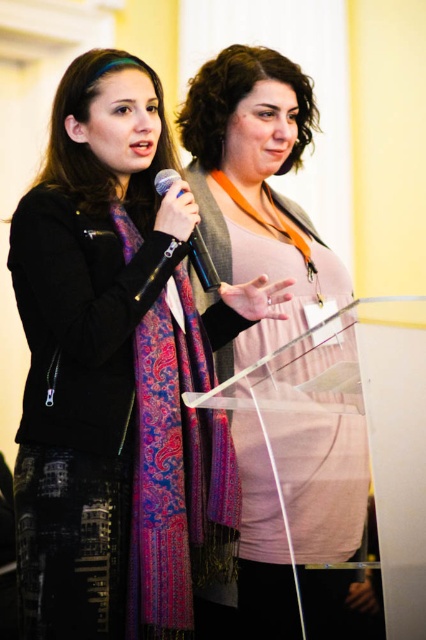
Question: Which object is closer to the camera taking this photo?

Choices:
 (A) matte black jacket at left
 (B) paisley-patterned silk scarf at center
 (C) metallic blue microphone at center

Answer: (A)

Question: Which of the following is the closest to the observer?

Choices:
 (A) pink fabric at center
 (B) paisley-patterned silk scarf at center
 (C) metallic blue microphone at center
 (D) matte black jacket at left

Answer: (D)

Question: Does matte black jacket at left appear under paisley-patterned silk scarf at center?

Choices:
 (A) no
 (B) yes

Answer: (A)

Question: Which point is farther to the camera?

Choices:
 (A) (193, 268)
 (B) (46, 456)

Answer: (A)

Question: Can you confirm if paisley-patterned silk scarf at center is bigger than metallic blue microphone at center?

Choices:
 (A) no
 (B) yes

Answer: (B)

Question: In this image, where is pink fabric at center located relative to metallic blue microphone at center?

Choices:
 (A) left
 (B) right

Answer: (B)